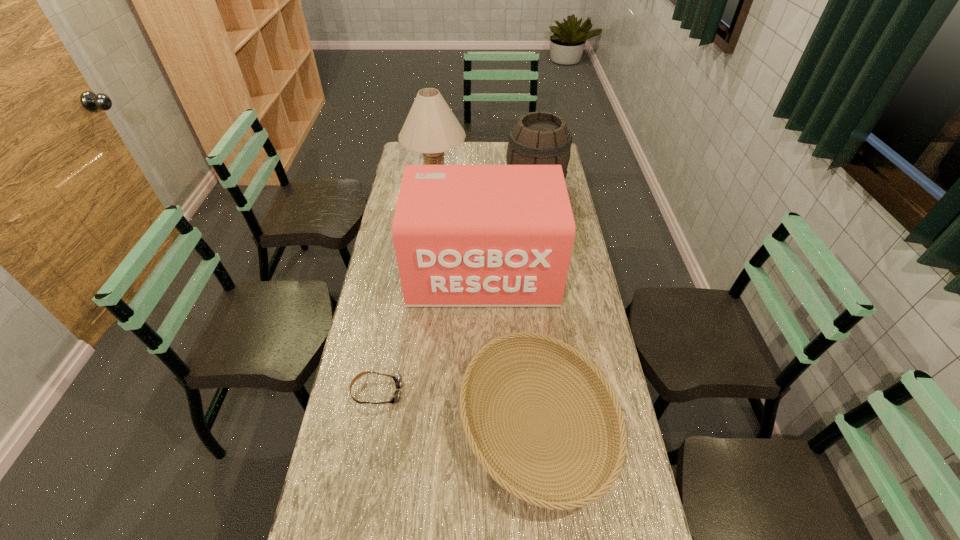
This screenshot has height=540, width=960. What are the coordinates of `the tallest object` in the screenshot? It's located at (431, 128).

Identify the location of box. (464, 235).

The height and width of the screenshot is (540, 960). I want to click on wine bucket, so click(539, 138).

Where is `basket`? basket is located at coordinates (617, 433).

The width and height of the screenshot is (960, 540). Identify the location of the shortest object. (397, 379).

Image resolution: width=960 pixels, height=540 pixels. What are the coordinates of `blank area located 0.160m on the front of the tallest object` in the screenshot? It's located at (432, 232).

Locate an element on the screen. vacant space situated on the surface of the box where the text is embossed is located at coordinates point(484,330).

You are a GUI agent. You are given a task and a screenshot of the screen. Output one action in this format:
    pyautogui.click(x=<x>, y=<y>)
    Task: Click on the vacant space situated 0.090m on the left of the wine bucket
    
    Given the screenshot: What is the action you would take?
    pyautogui.click(x=486, y=187)

Where is `vacant space situated 0.090m on the back of the basket`? This screenshot has height=540, width=960. vacant space situated 0.090m on the back of the basket is located at coordinates (528, 328).

Find the location of a particular element. vacant space located on the front-facing side of the shortest object is located at coordinates (444, 392).